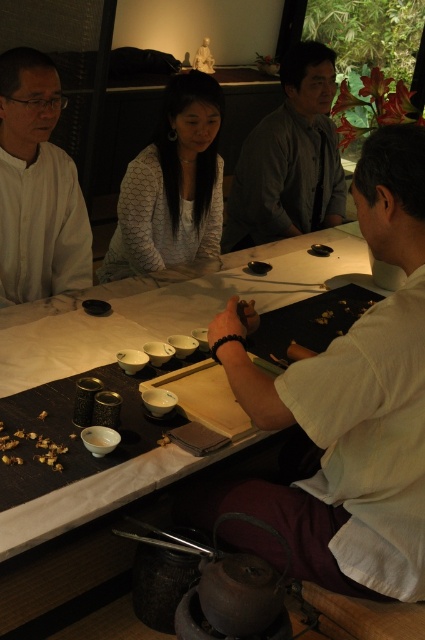
Which of these two, white textured sweater at center or wooden chopsticks at center, stands shorter?

wooden chopsticks at center is shorter.

Who is positioned more to the left, white textured sweater at center or wooden chopsticks at center?

From the viewer's perspective, white textured sweater at center appears more on the left side.

Between point (210, 182) and point (207, 362), which one is positioned behind?

The point (210, 182) is more distant.

Where is `white textured sweater at center`? white textured sweater at center is located at coordinates (172, 186).

Does white matte shirt at center lie in front of brown crumbly food at lower left?

Yes, white matte shirt at center is closer to the viewer.

This screenshot has width=425, height=640. I want to click on white matte shirt at center, so click(353, 404).

Does brown crumbly food at lower left have a smaller size compared to matte white bowl at center?

No, brown crumbly food at lower left is not smaller than matte white bowl at center.

Does brown crumbly food at lower left appear on the left side of matte white bowl at center?

Yes, brown crumbly food at lower left is to the left of matte white bowl at center.

Does point (51, 456) come farther from viewer compared to point (153, 401)?

No, it is not.

Image resolution: width=425 pixels, height=640 pixels. Find the location of `brown crumbly food at lower left`. brown crumbly food at lower left is located at coordinates [34, 445].